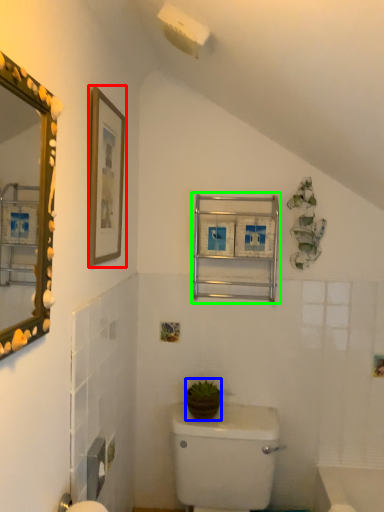
Question: Estimate the real-world distances between objects in this image. Which object is closer to picture frame (highlighted by a red box), plant (highlighted by a blue box) or medicine cabinet (highlighted by a green box)?

Choices:
 (A) plant
 (B) medicine cabinet

Answer: (B)